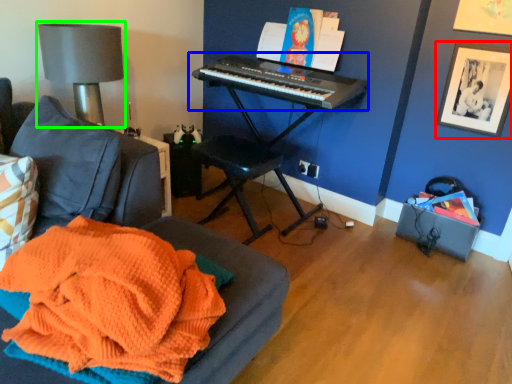
Question: Which object is positioned farthest from picture frame (highlighted by a red box)? Select from musical keyboard (highlighted by a blue box) and table lamp (highlighted by a green box).

Choices:
 (A) musical keyboard
 (B) table lamp

Answer: (B)